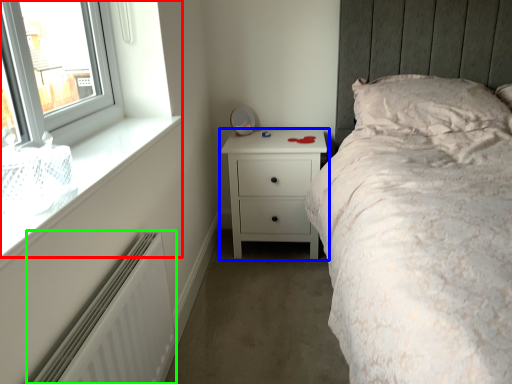
Question: Considering the real-world distances, which object is farthest from window (highlighted by a red box)? chest of drawers (highlighted by a blue box) or radiator (highlighted by a green box)?

Choices:
 (A) chest of drawers
 (B) radiator

Answer: (A)